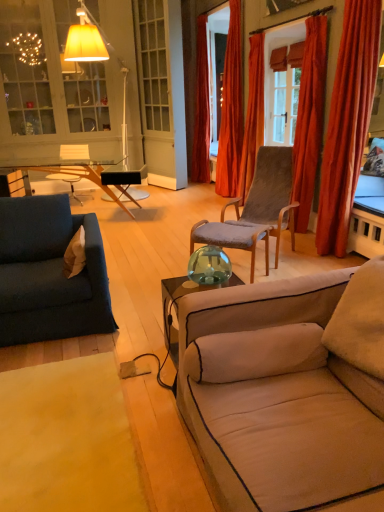
Question: Is velvet brown chair at center further to camera compared to velvet orange curtain at center, which is the 5th curtain from front to back?

Choices:
 (A) yes
 (B) no

Answer: (B)

Question: Is velvet brown chair at center closer to camera compared to velvet orange curtain at center, which is counted as the 1th curtain, starting from the back?

Choices:
 (A) no
 (B) yes

Answer: (B)

Question: Are velvet brown chair at center and velvet orange curtain at center, which is counted as the 1th curtain, starting from the back, beside each other?

Choices:
 (A) no
 (B) yes

Answer: (A)

Question: Is velvet brown chair at center not close to velvet orange curtain at center, which is counted as the 1th curtain, starting from the back?

Choices:
 (A) no
 (B) yes

Answer: (B)

Question: From the image's perspective, would you say velvet brown chair at center is shown under velvet orange curtain at center, which is counted as the 1th curtain, starting from the back?

Choices:
 (A) no
 (B) yes

Answer: (B)

Question: Could you tell me if velvet brown chair at center is facing velvet orange curtain at center, which is counted as the 1th curtain, starting from the back?

Choices:
 (A) no
 (B) yes

Answer: (A)

Question: Is velvet brown chair at center bigger than beige fabric pillow at left?

Choices:
 (A) yes
 (B) no

Answer: (A)

Question: Is velvet brown chair at center positioned behind beige fabric pillow at left?

Choices:
 (A) no
 (B) yes

Answer: (B)

Question: From the image's perspective, is velvet brown chair at center above beige fabric pillow at left?

Choices:
 (A) no
 (B) yes

Answer: (B)

Question: Is velvet brown chair at center smaller than beige fabric pillow at left?

Choices:
 (A) no
 (B) yes

Answer: (A)

Question: From a real-world perspective, is velvet brown chair at center under beige fabric pillow at left?

Choices:
 (A) yes
 (B) no

Answer: (A)

Question: From the image's perspective, is velvet brown chair at center under beige fabric pillow at left?

Choices:
 (A) no
 (B) yes

Answer: (A)

Question: Considering the relative sizes of orange velvet curtain at center, placed as the 3th curtain when sorted from back to front, and matte glass cabinet at upper left in the image provided, is orange velvet curtain at center, placed as the 3th curtain when sorted from back to front, bigger than matte glass cabinet at upper left?

Choices:
 (A) yes
 (B) no

Answer: (B)